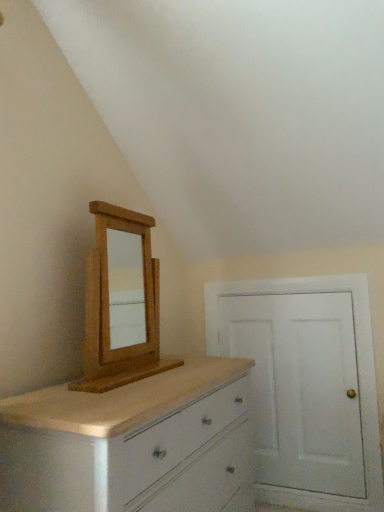
You are a GUI agent. You are given a task and a screenshot of the screen. Output one action in this format:
    pyautogui.click(x=<x>, y=<y>)
    Task: Click on the white painted wood door at right
    
    Given the screenshot: What is the action you would take?
    pyautogui.click(x=300, y=387)

Measure the distance between white painted wood door at right and camera.

They are 1.91 meters apart.

I want to click on light brown wood medicine cabinet at upper left, so click(121, 303).

In order to click on white painted wood door at right in this screenshot , I will do `click(300, 387)`.

Is point (281, 295) farther from camera compared to point (31, 422)?

Yes, point (281, 295) is farther from viewer.

Measure the distance from white painted wood door at right to white painted wood chest of drawers at lower left.

A distance of 69.03 centimeters exists between white painted wood door at right and white painted wood chest of drawers at lower left.

Are white painted wood door at right and white painted wood chest of drawers at lower left far apart?

Actually, white painted wood door at right and white painted wood chest of drawers at lower left are a little close together.

Who is bigger, white painted wood door at right or white painted wood chest of drawers at lower left?

Bigger between the two is white painted wood chest of drawers at lower left.

Where is `door that is on the right side of light brown wood medicine cabinet at upper left`? The height and width of the screenshot is (512, 384). door that is on the right side of light brown wood medicine cabinet at upper left is located at coordinates (300, 387).

Which is more to the right, light brown wood medicine cabinet at upper left or white painted wood door at right?

Positioned to the right is white painted wood door at right.

Between light brown wood medicine cabinet at upper left and white painted wood door at right, which one is positioned behind?

white painted wood door at right is further from the camera.

Is light brown wood medicine cabinet at upper left not near white painted wood door at right?

No, there isn't a large distance between light brown wood medicine cabinet at upper left and white painted wood door at right.

Looking at this image, is white painted wood chest of drawers at lower left completely or partially inside light brown wood medicine cabinet at upper left?

No, light brown wood medicine cabinet at upper left does not contain white painted wood chest of drawers at lower left.

Is light brown wood medicine cabinet at upper left facing towards white painted wood chest of drawers at lower left?

No.

From a real-world perspective, relative to white painted wood chest of drawers at lower left, is light brown wood medicine cabinet at upper left vertically above or below?

In terms of real-world spatial position, light brown wood medicine cabinet at upper left is above white painted wood chest of drawers at lower left.

This screenshot has height=512, width=384. I want to click on the chest of drawers located in front of the light brown wood medicine cabinet at upper left, so click(130, 443).

Considering the relative positions of white painted wood chest of drawers at lower left and white painted wood door at right in the image provided, is white painted wood chest of drawers at lower left to the right of white painted wood door at right from the viewer's perspective?

Incorrect, white painted wood chest of drawers at lower left is not on the right side of white painted wood door at right.

From a real-world perspective, is white painted wood chest of drawers at lower left positioned under white painted wood door at right based on gravity?

Yes.

Between white painted wood chest of drawers at lower left and white painted wood door at right, which one has less height?

With less height is white painted wood chest of drawers at lower left.

Between point (272, 357) and point (120, 215), which one is positioned in front?

The point (120, 215) is in front.

Can light brown wood medicine cabinet at upper left be found inside white painted wood door at right?

No.

Considering the sizes of objects white painted wood door at right and light brown wood medicine cabinet at upper left in the image provided, who is smaller, white painted wood door at right or light brown wood medicine cabinet at upper left?

white painted wood door at right is smaller.

From a real-world perspective, which is physically below, white painted wood chest of drawers at lower left or light brown wood medicine cabinet at upper left?

white painted wood chest of drawers at lower left, from a real-world perspective.

Which is behind, white painted wood chest of drawers at lower left or light brown wood medicine cabinet at upper left?

light brown wood medicine cabinet at upper left is further from the camera.

Is light brown wood medicine cabinet at upper left a part of white painted wood chest of drawers at lower left?

No, white painted wood chest of drawers at lower left does not contain light brown wood medicine cabinet at upper left.

Is white painted wood chest of drawers at lower left not close to light brown wood medicine cabinet at upper left?

white painted wood chest of drawers at lower left is actually quite close to light brown wood medicine cabinet at upper left.

Where is `door on the right of white painted wood chest of drawers at lower left`? The width and height of the screenshot is (384, 512). door on the right of white painted wood chest of drawers at lower left is located at coordinates (300, 387).

Image resolution: width=384 pixels, height=512 pixels. What are the coordinates of `medicine cabinet above the white painted wood door at right (from the image's perspective)` in the screenshot? It's located at (121, 303).

In the scene shown: Considering their positions, is white painted wood door at right positioned closer to light brown wood medicine cabinet at upper left than white painted wood chest of drawers at lower left?

Among the two, white painted wood chest of drawers at lower left is located nearer to light brown wood medicine cabinet at upper left.

From the image, which object appears to be nearer to white painted wood chest of drawers at lower left, light brown wood medicine cabinet at upper left or white painted wood door at right?

The object closer to white painted wood chest of drawers at lower left is light brown wood medicine cabinet at upper left.

Looking at this image, from the image, which object appears to be farther from white painted wood door at right, light brown wood medicine cabinet at upper left or white painted wood chest of drawers at lower left?

light brown wood medicine cabinet at upper left lies further to white painted wood door at right than the other object.

When comparing their distances from white painted wood door at right, does white painted wood chest of drawers at lower left or light brown wood medicine cabinet at upper left seem further?

light brown wood medicine cabinet at upper left is positioned further to the anchor white painted wood door at right.

Looking at the image, which one is located closer to white painted wood chest of drawers at lower left, white painted wood door at right or light brown wood medicine cabinet at upper left?

light brown wood medicine cabinet at upper left lies closer to white painted wood chest of drawers at lower left than the other object.

Estimate the real-world distances between objects in this image. Which object is further from light brown wood medicine cabinet at upper left, white painted wood chest of drawers at lower left or white painted wood door at right?

white painted wood door at right lies further to light brown wood medicine cabinet at upper left than the other object.

Where is `medicine cabinet located between white painted wood chest of drawers at lower left and white painted wood door at right in the depth direction`? medicine cabinet located between white painted wood chest of drawers at lower left and white painted wood door at right in the depth direction is located at coordinates (121, 303).